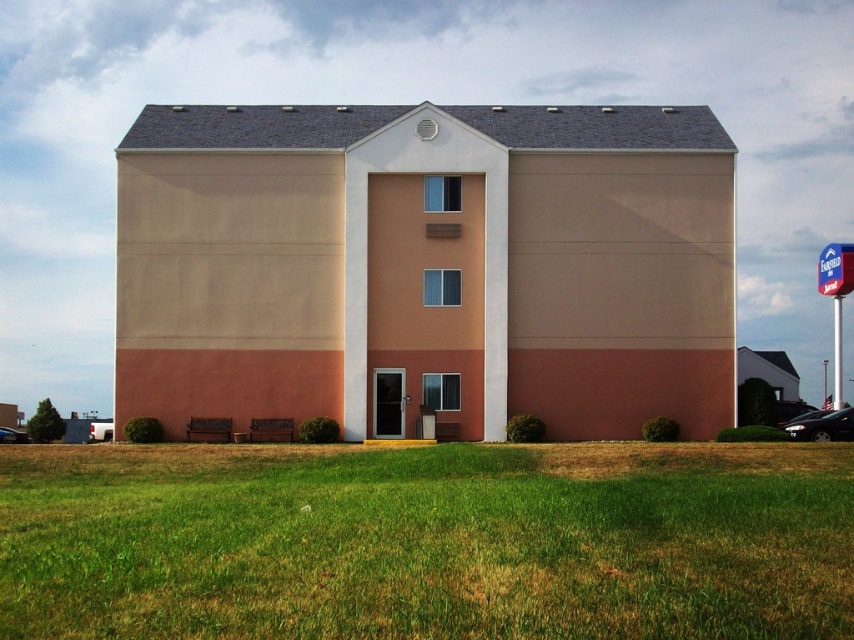
Question: Which object is farther from the camera taking this photo?

Choices:
 (A) metallic silver car at lower left
 (B) green grass at lower center
 (C) black glossy car at lower right

Answer: (A)

Question: Does green grass at lower center have a larger size compared to black glossy car at lower right?

Choices:
 (A) yes
 (B) no

Answer: (A)

Question: Which point is closer to the camera?

Choices:
 (A) (4, 426)
 (B) (797, 424)

Answer: (B)

Question: Is green grass at lower center bigger than metallic silver car at lower left?

Choices:
 (A) no
 (B) yes

Answer: (B)

Question: Can you confirm if black glossy car at lower right is smaller than metallic silver car at lower left?

Choices:
 (A) no
 (B) yes

Answer: (B)

Question: Which of the following is the farthest from the observer?

Choices:
 (A) green grass at lower center
 (B) metallic silver car at lower left
 (C) black glossy car at lower right

Answer: (B)